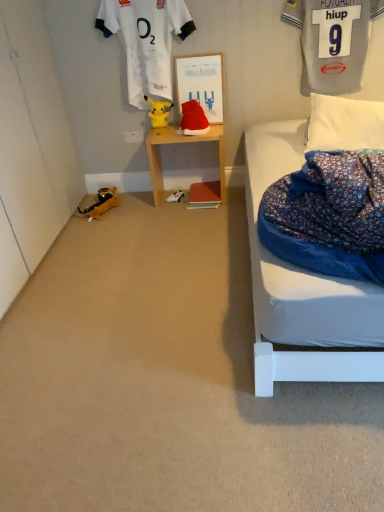
Identify the location of free space to the left of yellow rubber duck at lower left, the first toy when ordered from left to right. The height and width of the screenshot is (512, 384). (78, 206).